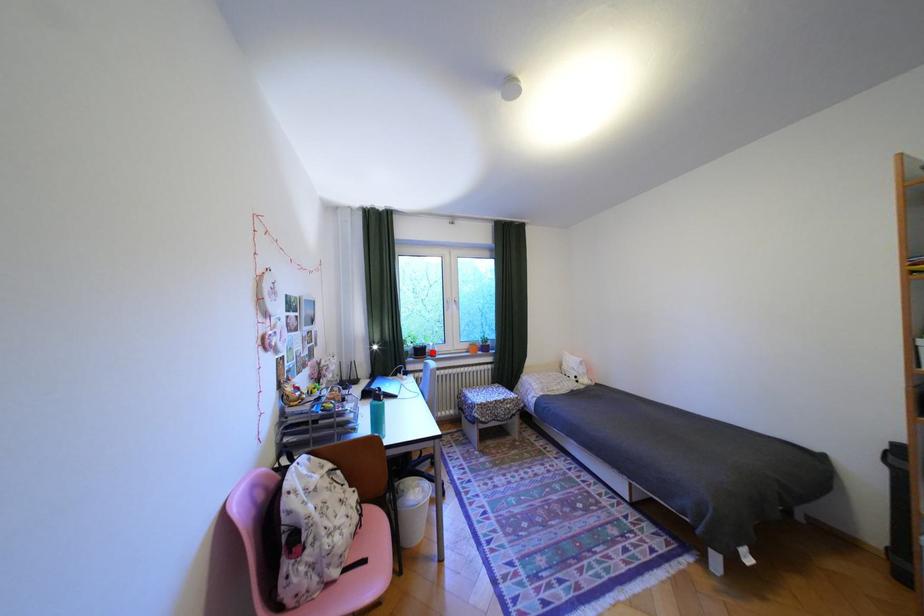
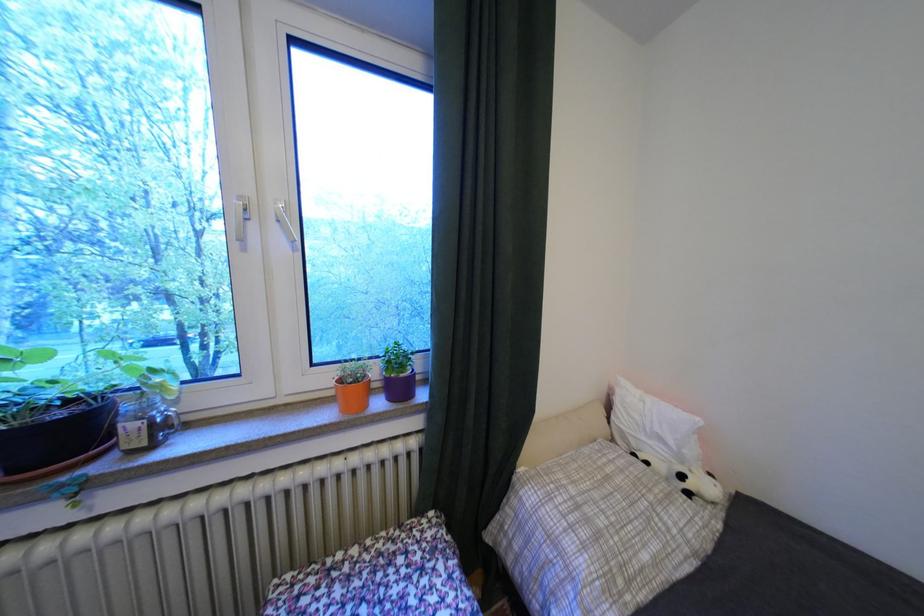
Find the pixel in the second image that matches the highlighted location in the first image.

(75, 436)